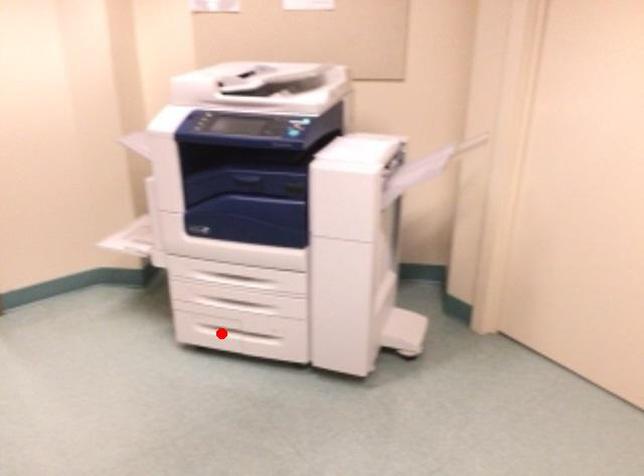
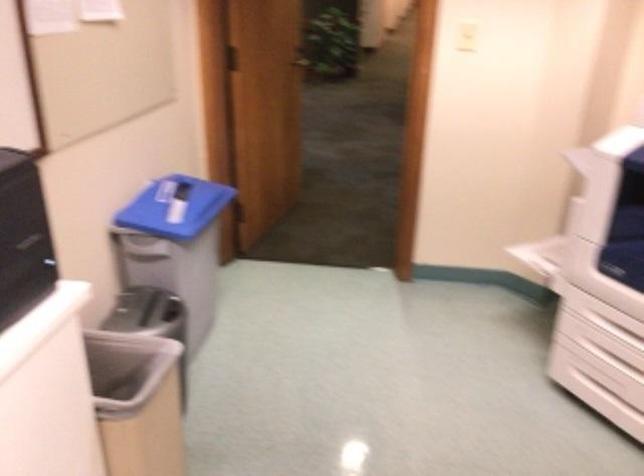
The point at the highlighted location is marked in the first image. Where is the corresponding point in the second image?

(605, 398)